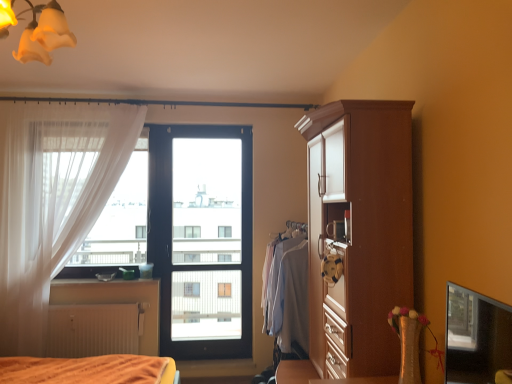
Question: Considering the relative positions of transparent glass screen door at center and white sheer curtain at left in the image provided, is transparent glass screen door at center in front of white sheer curtain at left?

Choices:
 (A) no
 (B) yes

Answer: (A)

Question: Is transparent glass screen door at center touching white sheer curtain at left?

Choices:
 (A) yes
 (B) no

Answer: (B)

Question: From a real-world perspective, is transparent glass screen door at center on top of white sheer curtain at left?

Choices:
 (A) yes
 (B) no

Answer: (B)

Question: Would you consider transparent glass screen door at center to be distant from white sheer curtain at left?

Choices:
 (A) yes
 (B) no

Answer: (A)

Question: Does transparent glass screen door at center have a larger size compared to white sheer curtain at left?

Choices:
 (A) yes
 (B) no

Answer: (B)

Question: From a real-world perspective, is transparent glass window screen at lower right positioned above or below white matte radiator at lower left?

Choices:
 (A) below
 (B) above

Answer: (B)

Question: Is transparent glass window screen at lower right in front of or behind white matte radiator at lower left in the image?

Choices:
 (A) behind
 (B) front

Answer: (B)

Question: Is transparent glass window screen at lower right inside or outside of white matte radiator at lower left?

Choices:
 (A) outside
 (B) inside

Answer: (A)

Question: From the image's perspective, relative to white matte radiator at lower left, is transparent glass window screen at lower right above or below?

Choices:
 (A) above
 (B) below

Answer: (A)

Question: Considering the positions of light blue fabric shirt at center and transparent glass screen door at center in the image, is light blue fabric shirt at center wider or thinner than transparent glass screen door at center?

Choices:
 (A) thin
 (B) wide

Answer: (B)

Question: From a real-world perspective, is light blue fabric shirt at center physically located above or below transparent glass screen door at center?

Choices:
 (A) above
 (B) below

Answer: (B)

Question: In the image, is light blue fabric shirt at center on the left side or the right side of transparent glass screen door at center?

Choices:
 (A) right
 (B) left

Answer: (A)

Question: Is light blue fabric shirt at center in front of or behind transparent glass screen door at center in the image?

Choices:
 (A) behind
 (B) front

Answer: (B)

Question: In terms of height, does yellow frosted glass light fixture at upper left look taller or shorter compared to white matte radiator at lower left?

Choices:
 (A) short
 (B) tall

Answer: (A)

Question: Looking at their shapes, would you say yellow frosted glass light fixture at upper left is wider or thinner than white matte radiator at lower left?

Choices:
 (A) thin
 (B) wide

Answer: (B)